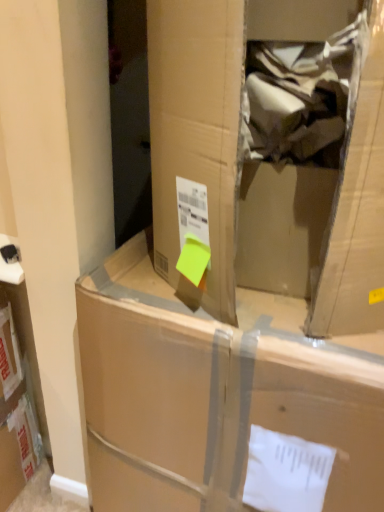
Question: Is point pyautogui.click(x=241, y=340) closer or farther from the camera than point pyautogui.click(x=329, y=138)?

Choices:
 (A) closer
 (B) farther

Answer: (B)

Question: From the image's perspective, is cardboard box at center positioned above or below brown cardboard box at center?

Choices:
 (A) below
 (B) above

Answer: (A)

Question: Looking at their shapes, would you say cardboard box at center is wider or thinner than brown cardboard box at center?

Choices:
 (A) thin
 (B) wide

Answer: (B)

Question: Is brown cardboard box at center inside the boundaries of cardboard box at center, or outside?

Choices:
 (A) inside
 (B) outside

Answer: (B)

Question: Considering the positions of brown cardboard box at center and cardboard box at center in the image, is brown cardboard box at center bigger or smaller than cardboard box at center?

Choices:
 (A) small
 (B) big

Answer: (A)

Question: Is brown cardboard box at center taller or shorter than cardboard box at center?

Choices:
 (A) short
 (B) tall

Answer: (A)

Question: Considering the positions of point (178, 159) and point (127, 271), is point (178, 159) closer or farther from the camera than point (127, 271)?

Choices:
 (A) closer
 (B) farther

Answer: (A)